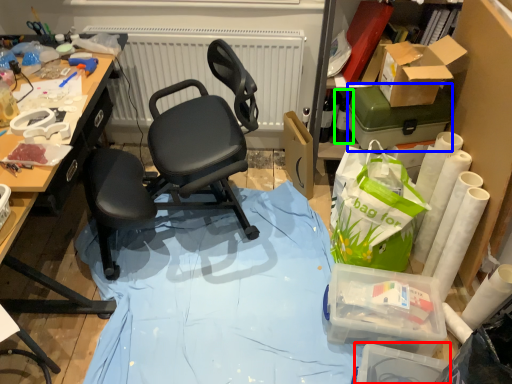
Question: Which object is positioned farthest from box (highlighted by a red box)? Select from box (highlighted by a blue box) and bottle (highlighted by a green box).

Choices:
 (A) box
 (B) bottle

Answer: (B)